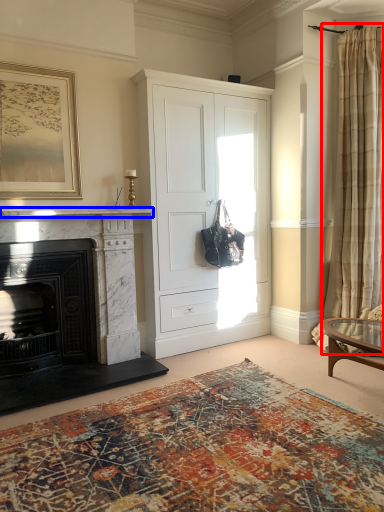
Question: Which object appears closest to the camera in this image, curtain (highlighted by a red box) or mantle (highlighted by a blue box)?

Choices:
 (A) curtain
 (B) mantle

Answer: (B)